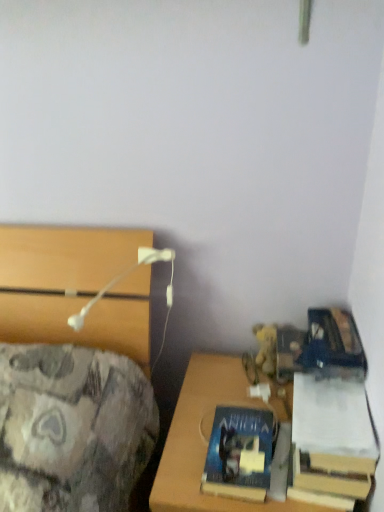
Find the location of a particular element. This screenshot has height=512, width=384. free point behind blue matte book at lower right, the 1th book when ordered from left to right is located at coordinates (228, 400).